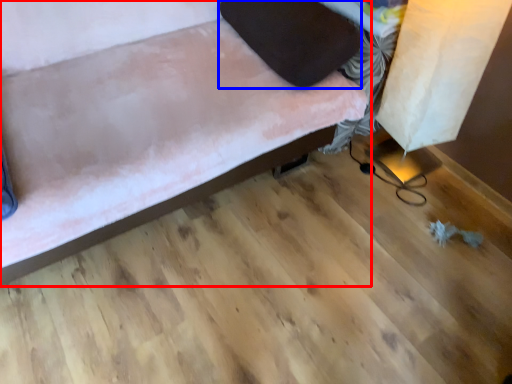
Question: Which of the following is the closest to the observer, furniture (highlighted by a red box) or pillow (highlighted by a blue box)?

Choices:
 (A) furniture
 (B) pillow

Answer: (A)